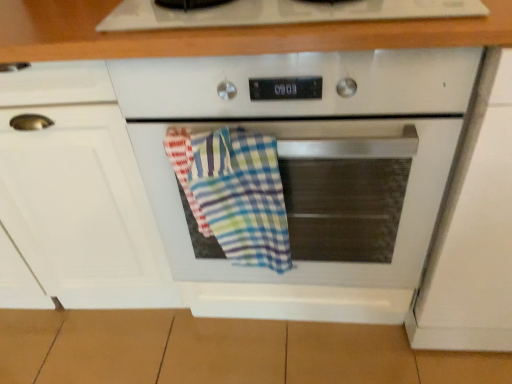
Question: From a real-world perspective, is white glossy oven at center physically located above or below white matte cabinet at right, which is counted as the 2th cabinetry, starting from the left?

Choices:
 (A) above
 (B) below

Answer: (B)

Question: From the image's perspective, is white glossy oven at center located above or below white matte cabinet at right, the 1th cabinetry from the right?

Choices:
 (A) above
 (B) below

Answer: (B)

Question: Estimate the real-world distances between objects in this image. Which object is closer to the white glossy oven at center?

Choices:
 (A) multicolored checkered towel at center
 (B) white matte cabinet at left, marked as the 1th cabinetry in a left-to-right arrangement
 (C) white matte cabinet at right, which is counted as the 2th cabinetry, starting from the left

Answer: (A)

Question: Which is nearer to the multicolored checkered towel at center?

Choices:
 (A) white matte cabinet at right, the 1th cabinetry from the right
 (B) white glossy oven at center
 (C) white matte cabinet at left, marked as the 1th cabinetry in a left-to-right arrangement

Answer: (B)